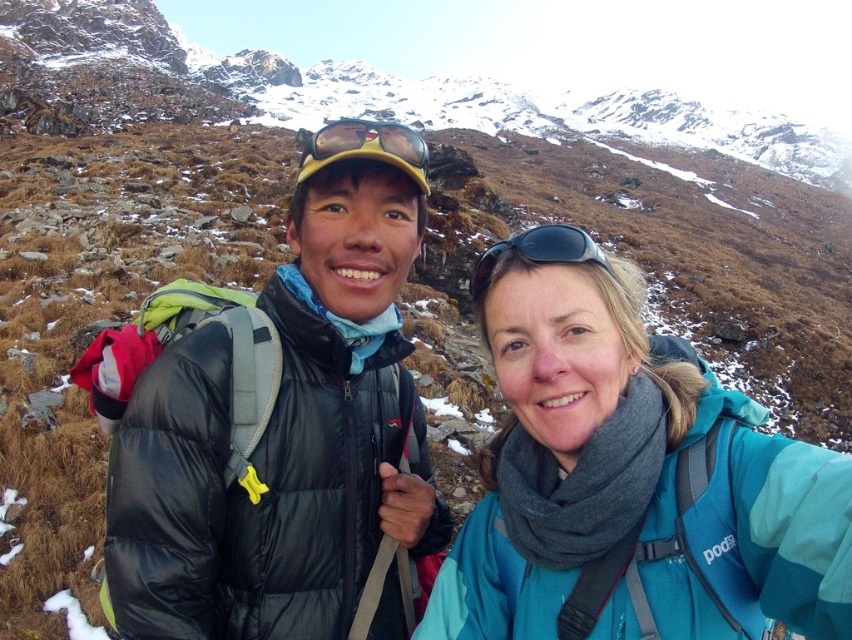
Question: Which of the following is the farthest from the observer?

Choices:
 (A) black plastic sunglasses at center
 (B) teal fleece jacket at center

Answer: (A)

Question: Which of the following is the farthest from the observer?

Choices:
 (A) black puffer jacket at center
 (B) black puffer jacket at left

Answer: (A)

Question: Can you confirm if teal fleece jacket at center is positioned to the left of yellow matte goggles at center?

Choices:
 (A) no
 (B) yes

Answer: (A)

Question: Estimate the real-world distances between objects in this image. Which object is farther from the black puffer jacket at left?

Choices:
 (A) black puffer jacket at center
 (B) black plastic sunglasses at center
 (C) yellow matte goggles at center
 (D) teal fleece jacket at center

Answer: (C)

Question: Does black puffer jacket at center have a larger size compared to teal fleece jacket at center?

Choices:
 (A) no
 (B) yes

Answer: (B)

Question: From the image, what is the correct spatial relationship of black puffer jacket at left in relation to black puffer jacket at center?

Choices:
 (A) right
 (B) left

Answer: (A)